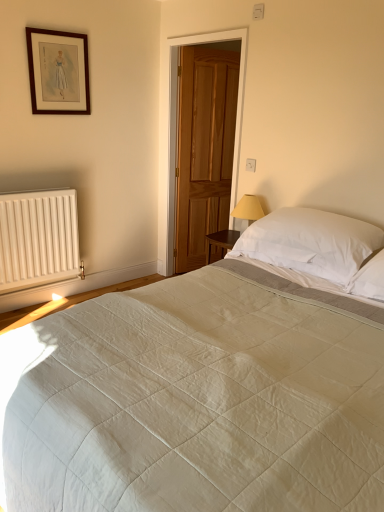
Where is `glossy wood door at center`? glossy wood door at center is located at coordinates (207, 147).

Identify the location of white quilted bed at center. (201, 402).

Measure the distance between point [48,241] and camera.

Point [48,241] is 3.24 meters from camera.

What do you see at coordinates (311, 242) in the screenshot?
I see `white soft pillow at upper right` at bounding box center [311, 242].

I want to click on glossy wood door at center, so click(207, 147).

Is white matte radiator at lower left taller than glossy wood door at center?

In fact, white matte radiator at lower left may be shorter than glossy wood door at center.

Is white matte radiator at lower left positioned with its back to glossy wood door at center?

No, white matte radiator at lower left's orientation is not away from glossy wood door at center.

Is white matte radiator at lower left at the left side of glossy wood door at center?

Yes, white matte radiator at lower left is to the left of glossy wood door at center.

In the scene shown: From the image's perspective, is glossy wood door at center over wooden picture frame at upper left?

Actually, glossy wood door at center appears below wooden picture frame at upper left in the image.

Which is correct: glossy wood door at center is inside wooden picture frame at upper left, or outside of it?

glossy wood door at center is not enclosed by wooden picture frame at upper left.

Is glossy wood door at center beside wooden picture frame at upper left?

No, glossy wood door at center is not touching wooden picture frame at upper left.

Is white soft pillow at upper right in contact with white matte radiator at lower left?

white soft pillow at upper right and white matte radiator at lower left are not in contact.

In the scene shown: Can you confirm if white soft pillow at upper right is wider than white matte radiator at lower left?

Yes, white soft pillow at upper right is wider than white matte radiator at lower left.

Is white soft pillow at upper right oriented away from white matte radiator at lower left?

No, white soft pillow at upper right is not facing the opposite direction of white matte radiator at lower left.

Considering the relative positions of wooden picture frame at upper left and white matte radiator at lower left in the image provided, is wooden picture frame at upper left to the left of white matte radiator at lower left from the viewer's perspective?

No, wooden picture frame at upper left is not to the left of white matte radiator at lower left.

Is wooden picture frame at upper left shorter than white matte radiator at lower left?

Yes, wooden picture frame at upper left is shorter than white matte radiator at lower left.

From a real-world perspective, between wooden picture frame at upper left and white matte radiator at lower left, who is vertically lower?

white matte radiator at lower left.

Is white matte radiator at lower left a part of wooden picture frame at upper left?

No, wooden picture frame at upper left does not contain white matte radiator at lower left.

Which is more to the left, wooden picture frame at upper left or white soft pillow at upper right?

From the viewer's perspective, wooden picture frame at upper left appears more on the left side.

In terms of size, does wooden picture frame at upper left appear bigger or smaller than white soft pillow at upper right?

In the image, wooden picture frame at upper left appears to be smaller than white soft pillow at upper right.

Measure the distance from wooden picture frame at upper left to white soft pillow at upper right.

wooden picture frame at upper left is 6.27 feet from white soft pillow at upper right.

Considering the positions of points (26, 28) and (293, 252), is point (26, 28) closer to camera compared to point (293, 252)?

No, (26, 28) is further to viewer.

Who is shorter, white quilted bed at center or white soft pillow at upper right?

white soft pillow at upper right.

Is white quilted bed at center to the left of white soft pillow at upper right from the viewer's perspective?

Correct, you'll find white quilted bed at center to the left of white soft pillow at upper right.

Considering the relative sizes of white quilted bed at center and white soft pillow at upper right in the image provided, is white quilted bed at center bigger than white soft pillow at upper right?

Yes.

Is glossy wood door at center inside or outside of white quilted bed at center?

glossy wood door at center is not enclosed by white quilted bed at center.

From a real-world perspective, is glossy wood door at center beneath white quilted bed at center?

Actually, glossy wood door at center is physically above white quilted bed at center in the real world.

This screenshot has height=512, width=384. Find the location of `bed on the right of glossy wood door at center`. bed on the right of glossy wood door at center is located at coordinates (201, 402).

This screenshot has height=512, width=384. What are the coordinates of `radiator in front of the glossy wood door at center` in the screenshot? It's located at (38, 239).

Locate an element on the screen. door below the wooden picture frame at upper left (from a real-world perspective) is located at coordinates (207, 147).

Based on their spatial positions, is white matte radiator at lower left or white soft pillow at upper right closer to wooden picture frame at upper left?

white matte radiator at lower left lies closer to wooden picture frame at upper left than the other object.

Which object lies nearer to the anchor point white soft pillow at upper right, wooden picture frame at upper left or glossy wood door at center?

glossy wood door at center is closer to white soft pillow at upper right.

Considering their positions, is wooden picture frame at upper left positioned closer to glossy wood door at center than white quilted bed at center?

Based on the image, wooden picture frame at upper left appears to be nearer to glossy wood door at center.

Based on the photo, from the image, which object appears to be nearer to glossy wood door at center, white matte radiator at lower left or wooden picture frame at upper left?

The object closer to glossy wood door at center is wooden picture frame at upper left.

Considering their positions, is white matte radiator at lower left positioned closer to glossy wood door at center than white quilted bed at center?

white matte radiator at lower left.

Based on the photo, considering their positions, is white soft pillow at upper right positioned closer to white matte radiator at lower left than white quilted bed at center?

white soft pillow at upper right lies closer to white matte radiator at lower left than the other object.

Which object lies nearer to the anchor point white soft pillow at upper right, white quilted bed at center or glossy wood door at center?

Among the two, white quilted bed at center is located nearer to white soft pillow at upper right.

Based on their spatial positions, is white quilted bed at center or wooden picture frame at upper left closer to glossy wood door at center?

wooden picture frame at upper left lies closer to glossy wood door at center than the other object.

Locate an element on the screen. The width and height of the screenshot is (384, 512). door between wooden picture frame at upper left and white soft pillow at upper right from left to right is located at coordinates (x=207, y=147).

In order to click on picture frame located between white matte radiator at lower left and white soft pillow at upper right in the left-right direction in this screenshot , I will do `click(58, 72)`.

Locate an element on the screen. The height and width of the screenshot is (512, 384). pillow between white quilted bed at center and wooden picture frame at upper left along the z-axis is located at coordinates (311, 242).

What are the coordinates of `door between white matte radiator at lower left and white soft pillow at upper right from left to right` in the screenshot? It's located at (207, 147).